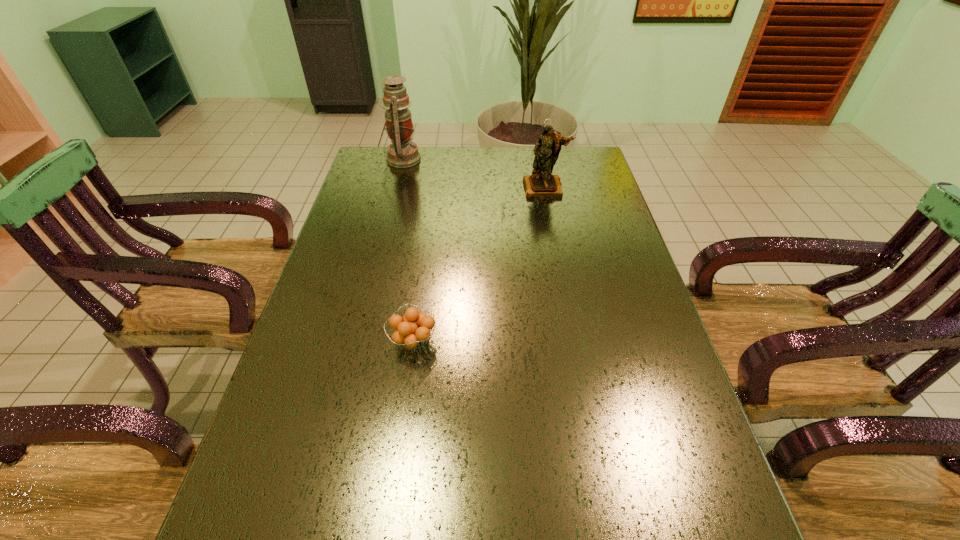
Identify which object is located as the second nearest to the tallest object. Please provide its 2D coordinates. Your answer should be formatted as a tuple, i.e. [(x, y)], where the tuple contains the x and y coordinates of a point satisfying the conditions above.

[(412, 330)]

Find the location of a particular element. free spot that satisfies the following two spatial constraints: 1. on the front side of the oil lamp; 2. on the left side of the shortest object is located at coordinates (355, 341).